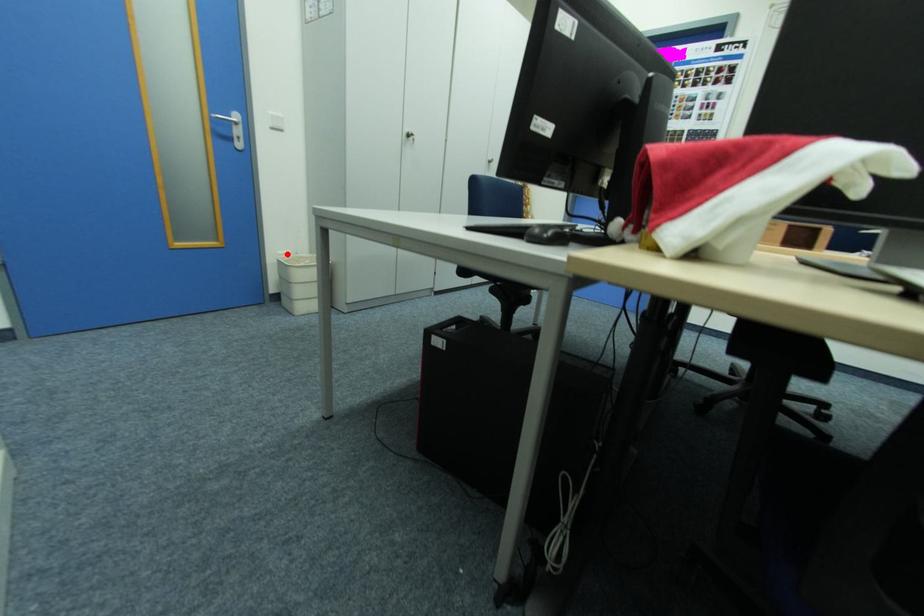
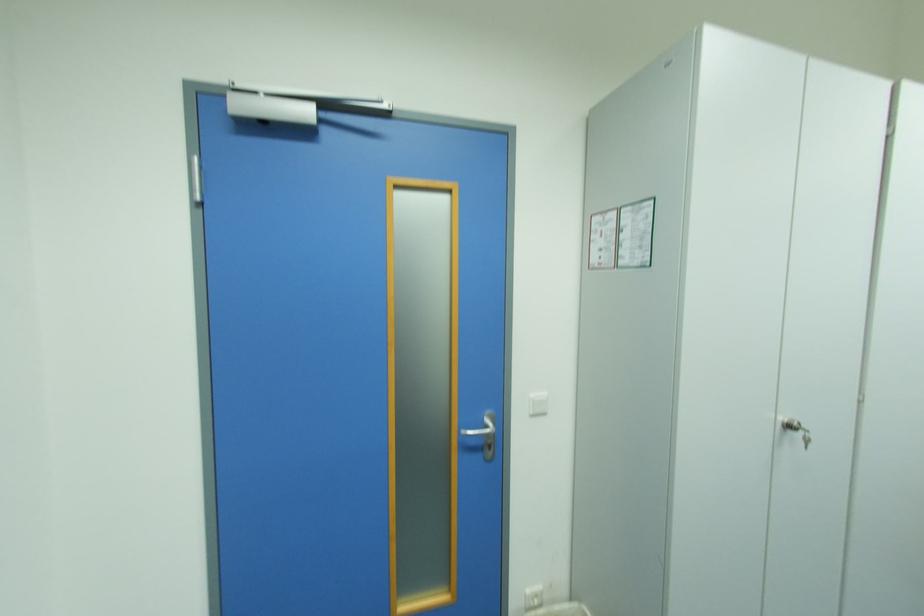
Locate, in the second image, the point that corresponds to the highlighted location in the first image.

(535, 592)